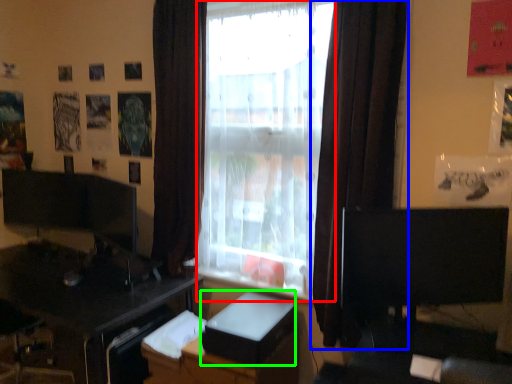
Question: Which object is positioned closest to window frame (highlighted by a red box)? Select from curtain (highlighted by a blue box) and cardboard box (highlighted by a green box).

Choices:
 (A) curtain
 (B) cardboard box

Answer: (A)